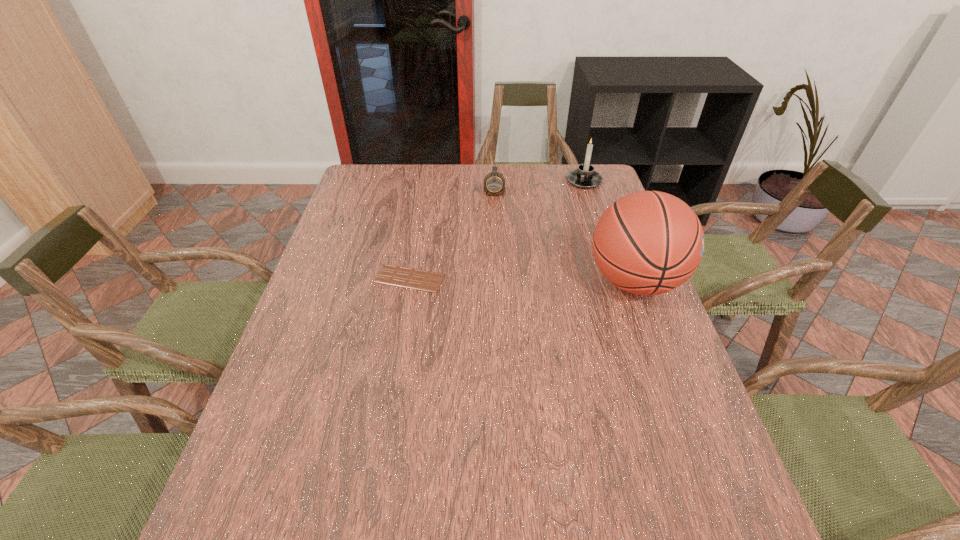
Image resolution: width=960 pixels, height=540 pixels. In order to click on vacant point at the right edge in this screenshot , I will do `click(678, 404)`.

In order to click on vacant region at the far left corner of the desktop in this screenshot , I will do `click(387, 197)`.

At what (x,y) coordinates should I click in order to perform the action: click on unoccupied position between the second shortest object and the chocolate bar. Please return your answer as a coordinate pair (x, y). This screenshot has width=960, height=540. Looking at the image, I should click on (452, 234).

This screenshot has height=540, width=960. Find the location of `free space between the candle holder and the compass`. free space between the candle holder and the compass is located at coordinates (539, 185).

Find the location of `vacant space in between the second tallest object and the chocolate bar`. vacant space in between the second tallest object and the chocolate bar is located at coordinates (496, 230).

Where is `vacant space in between the basketball and the shortest object`? The image size is (960, 540). vacant space in between the basketball and the shortest object is located at coordinates (522, 280).

Where is `vacant space that's between the compass and the tallest object`? This screenshot has width=960, height=540. vacant space that's between the compass and the tallest object is located at coordinates (564, 235).

Find the location of `vacant space that's between the second tallest object and the leftmost object`. vacant space that's between the second tallest object and the leftmost object is located at coordinates tap(496, 230).

The height and width of the screenshot is (540, 960). What are the coordinates of `free space that is in between the leftmost object and the second object from left to right` in the screenshot? It's located at (452, 234).

Identify the location of empty space between the basketball and the compass. This screenshot has height=540, width=960. (564, 235).